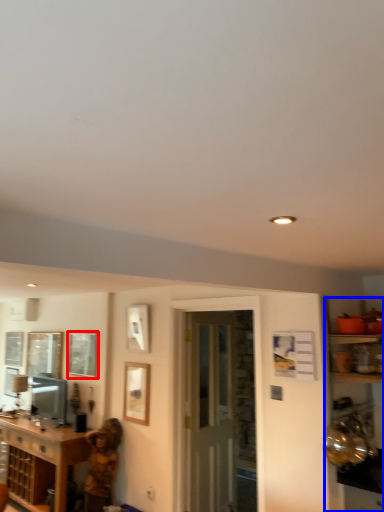
Question: Which of the following is the closest to the observer, window (highlighted by a red box) or entertainment center (highlighted by a blue box)?

Choices:
 (A) window
 (B) entertainment center

Answer: (B)